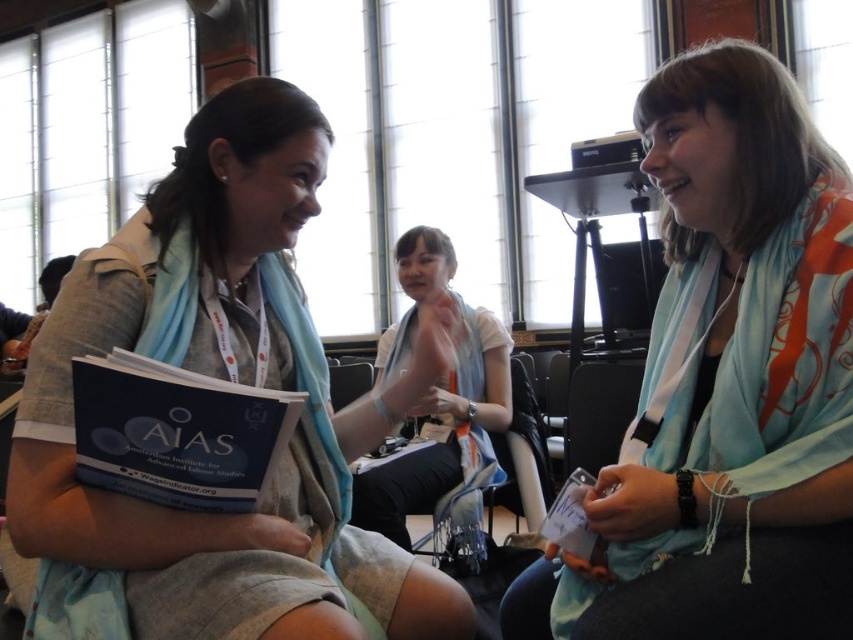
Question: Is light blue scarf at center below white silk scarf at center?

Choices:
 (A) yes
 (B) no

Answer: (A)

Question: Is the position of light blue scarf at center more distant than that of blue matte book at center?

Choices:
 (A) no
 (B) yes

Answer: (B)

Question: Estimate the real-world distances between objects in this image. Which object is farther from the blue matte book at center?

Choices:
 (A) white silk scarf at center
 (B) matte blue scarf at left

Answer: (A)

Question: Which point appears closest to the camera in this image?

Choices:
 (A) (93, 566)
 (B) (134, 472)
 (C) (434, 259)
 (D) (833, 536)

Answer: (B)

Question: Can you confirm if blue matte book at center is positioned to the left of white silk scarf at center?

Choices:
 (A) no
 (B) yes

Answer: (B)

Question: Among these objects, which one is nearest to the camera?

Choices:
 (A) matte blue scarf at left
 (B) light blue scarf at center
 (C) blue matte book at center

Answer: (C)